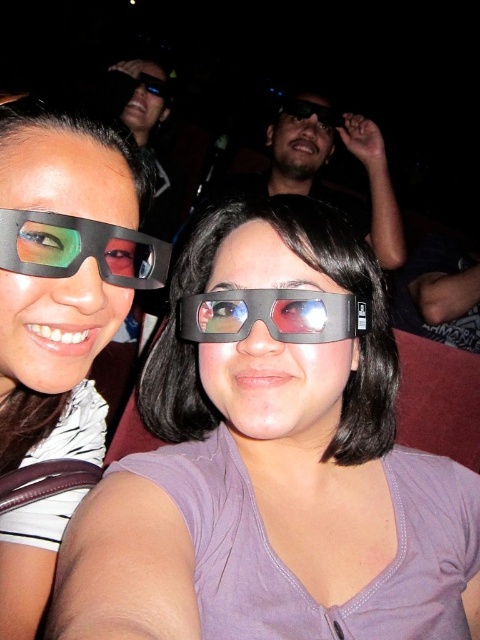
You are a moviegoer who wants to know if you can comfortably place your 3.5 inch wide phone between the matte black glasses at left and the matte black goggles at center. Based on the scene description, can you do this?

The distance between the matte black glasses at left and the matte black goggles at center is 6.68 inches. Since your phone is 3.5 inches wide, there is enough space to place it comfortably between them.

You are sitting in a movie theater and want to know which of the two points, point (103,268) or point (296,330), is closer to you. Can you determine this based on their positions?

Point (103,268) is in front of point (296,330), so it is closer to you.

You are designing a storage case for both the matte black 3d glasses at center and the matte black goggles at center. Since you want to ensure they fit snugly, which object requires a larger compartment in terms of physical dimensions?

The matte black goggles at center requires a larger compartment because the matte black 3d glasses at center has a smaller size compared to matte black goggles at center.